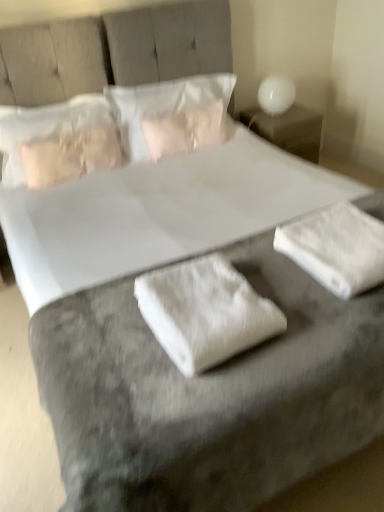
Question: Does satin beige pillow at upper left, placed as the 2th pillow when sorted from right to left, have a smaller size compared to white soft pillow at center, which appears as the second pillow when viewed from the left?

Choices:
 (A) no
 (B) yes

Answer: (B)

Question: Does satin beige pillow at upper left, placed as the 2th pillow when sorted from right to left, have a lesser width compared to white soft pillow at center, the first pillow from the right?

Choices:
 (A) no
 (B) yes

Answer: (B)

Question: Considering the relative positions of satin beige pillow at upper left, placed as the 2th pillow when sorted from right to left, and white soft pillow at center, which appears as the second pillow when viewed from the left, in the image provided, is satin beige pillow at upper left, placed as the 2th pillow when sorted from right to left, to the right of white soft pillow at center, which appears as the second pillow when viewed from the left, from the viewer's perspective?

Choices:
 (A) no
 (B) yes

Answer: (A)

Question: Is satin beige pillow at upper left, placed as the 2th pillow when sorted from right to left, positioned before white soft pillow at center, which appears as the second pillow when viewed from the left?

Choices:
 (A) no
 (B) yes

Answer: (B)

Question: From a real-world perspective, is satin beige pillow at upper left, placed as the 2th pillow when sorted from right to left, on top of white soft pillow at center, the first pillow from the right?

Choices:
 (A) yes
 (B) no

Answer: (A)

Question: Considering the relative sizes of satin beige pillow at upper left, placed as the 2th pillow when sorted from right to left, and white soft pillow at center, which appears as the second pillow when viewed from the left, in the image provided, is satin beige pillow at upper left, placed as the 2th pillow when sorted from right to left, wider than white soft pillow at center, which appears as the second pillow when viewed from the left,?

Choices:
 (A) yes
 (B) no

Answer: (B)

Question: Is white glossy table lamp at upper right completely or partially inside white fabric at center, the second material positioned from the right?

Choices:
 (A) no
 (B) yes

Answer: (A)

Question: From a real-world perspective, is white fabric at center, positioned as the first material in left-to-right order, positioned under white glossy table lamp at upper right based on gravity?

Choices:
 (A) no
 (B) yes

Answer: (B)

Question: Is white fabric at center, positioned as the first material in left-to-right order, at the left side of white glossy table lamp at upper right?

Choices:
 (A) no
 (B) yes

Answer: (B)

Question: Considering the relative sizes of white fabric at center, positioned as the first material in left-to-right order, and white glossy table lamp at upper right in the image provided, is white fabric at center, positioned as the first material in left-to-right order, thinner than white glossy table lamp at upper right?

Choices:
 (A) yes
 (B) no

Answer: (B)

Question: Is white fabric at center, positioned as the first material in left-to-right order, beside white glossy table lamp at upper right?

Choices:
 (A) yes
 (B) no

Answer: (B)

Question: Could you tell me if white fabric at center, positioned as the first material in left-to-right order, is turned towards white glossy table lamp at upper right?

Choices:
 (A) no
 (B) yes

Answer: (A)

Question: From the image's perspective, does white fabric at center, the second material positioned from the right, appear lower than white fluffy towel at lower right, positioned as the first material in right-to-left order?

Choices:
 (A) yes
 (B) no

Answer: (A)